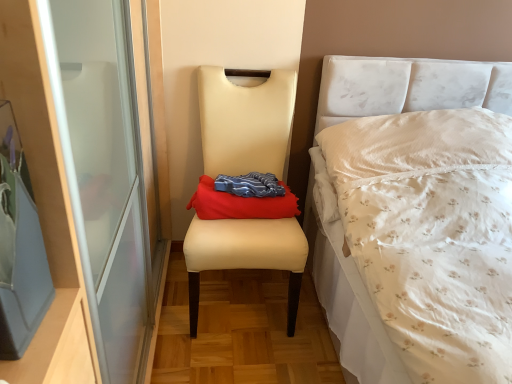
Where is `free region under beige leather chair at center (from a real-world perspective)`? The image size is (512, 384). free region under beige leather chair at center (from a real-world perspective) is located at coordinates (244, 296).